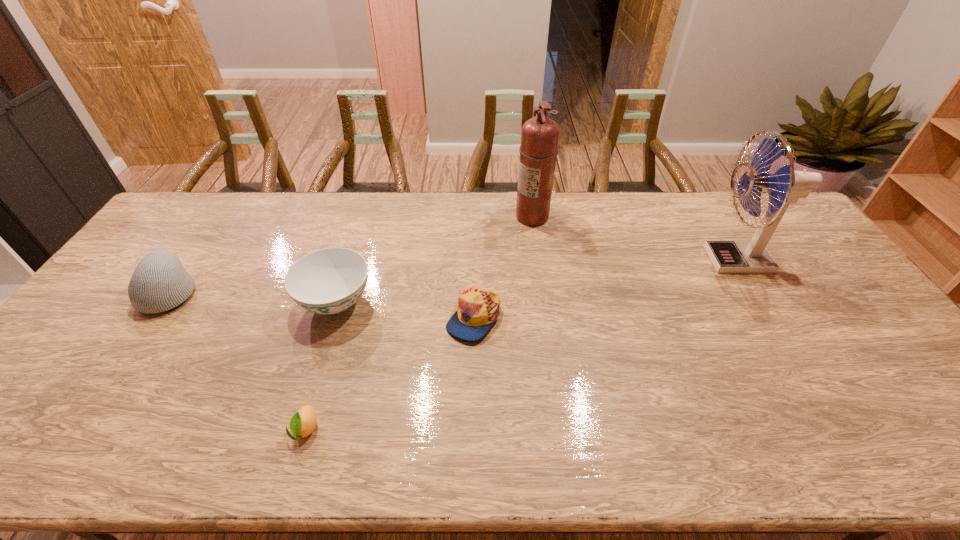
Locate an element on the screen. Image resolution: width=960 pixels, height=540 pixels. the second object from right to left is located at coordinates (538, 150).

The width and height of the screenshot is (960, 540). I want to click on the farthest object, so click(538, 150).

Where is `the rightmost object`? the rightmost object is located at coordinates (785, 186).

Locate an element on the screen. the leftmost object is located at coordinates (159, 283).

Identify the location of chinaware. (328, 281).

Locate an element on the screen. Image resolution: width=960 pixels, height=540 pixels. the third object from right to left is located at coordinates (478, 308).

Find the location of `the fifth tallest object`. the fifth tallest object is located at coordinates (478, 308).

At what (x,y) coordinates should I click in order to perform the action: click on the shortest object. Please return your answer as a coordinate pair (x, y). This screenshot has width=960, height=540. Looking at the image, I should click on (303, 422).

Locate an element on the screen. the nearest object is located at coordinates (303, 422).

What are the coordinates of `vacant space located 0.190m on the front-facing side of the fifth object from left to right` in the screenshot? It's located at click(461, 217).